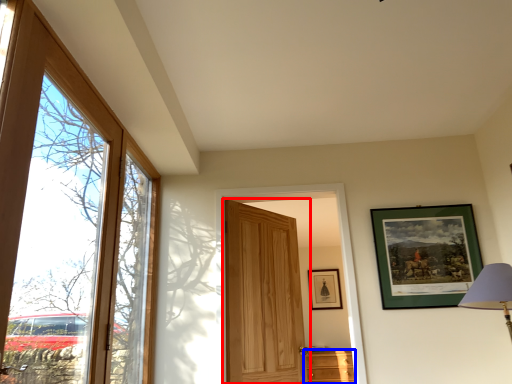
Question: Which point is further to the camera, door (highlighted by a red box) or cabinetry (highlighted by a blue box)?

Choices:
 (A) door
 (B) cabinetry

Answer: (B)